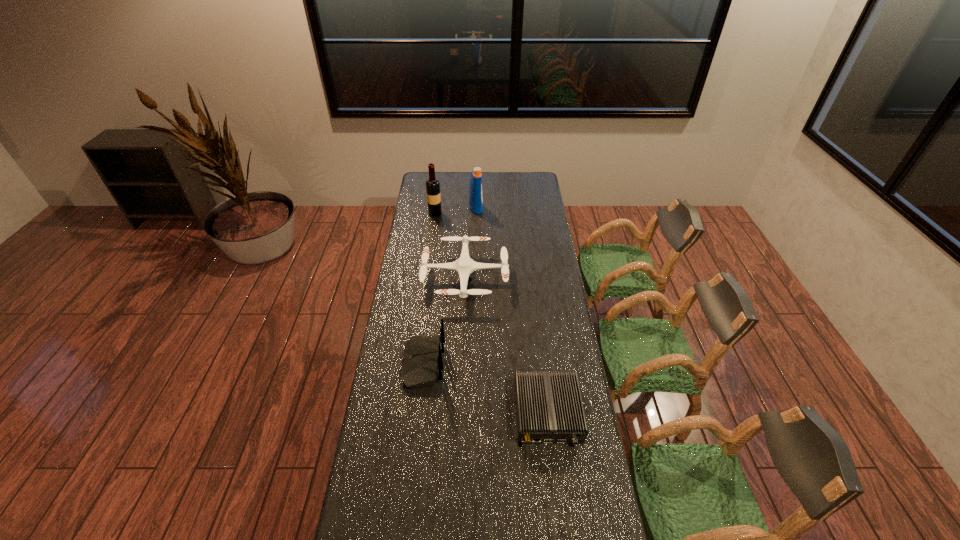
You are a GUI agent. You are given a task and a screenshot of the screen. Output one action in this format:
    pyautogui.click(x=<x>, y=<y>)
    Task: Click on the wine bottle
    The width and height of the screenshot is (960, 540).
    Given the screenshot: What is the action you would take?
    pyautogui.click(x=432, y=184)

What are the coordinates of `detergent` in the screenshot? It's located at (475, 190).

The width and height of the screenshot is (960, 540). Identify the location of the third shortest object. (422, 365).

Where is `the taller router`? This screenshot has height=540, width=960. the taller router is located at coordinates (422, 365).

The image size is (960, 540). I want to click on drone, so click(x=464, y=266).

Where is `the second shortest object`? This screenshot has width=960, height=540. the second shortest object is located at coordinates (464, 266).

This screenshot has width=960, height=540. In order to click on the right router in this screenshot , I will do (549, 409).

The image size is (960, 540). Identify the location of the shortest object. (549, 409).

What are the coordinates of `blank space located on the front of the wine bottle` in the screenshot? It's located at (432, 240).

The height and width of the screenshot is (540, 960). Find the location of `vacant area located 0.370m on the label of the detergent`. vacant area located 0.370m on the label of the detergent is located at coordinates (547, 208).